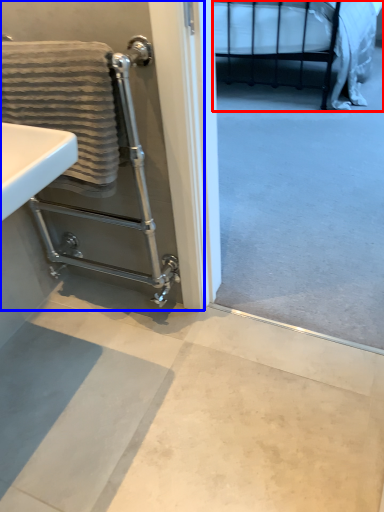
Question: Among these objects, which one is nearest to the camera, bed (highlighted by a red box) or screen door (highlighted by a blue box)?

Choices:
 (A) bed
 (B) screen door

Answer: (B)